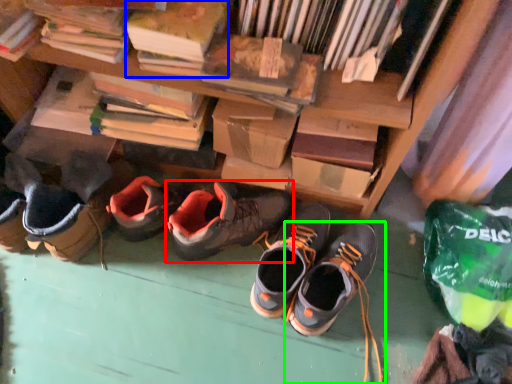
Question: Which object is the closest to the footwear (highlighted by a red box)? Choose among these: paperback book (highlighted by a blue box) or footwear (highlighted by a green box).

Choices:
 (A) paperback book
 (B) footwear

Answer: (B)